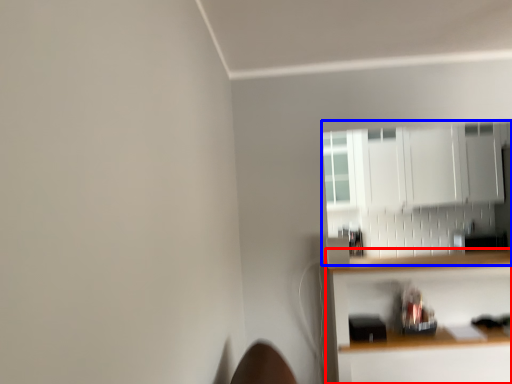
Question: Which of the following is the farthest to the observer, shelf (highlighted by a red box) or cabinetry (highlighted by a blue box)?

Choices:
 (A) shelf
 (B) cabinetry

Answer: (B)